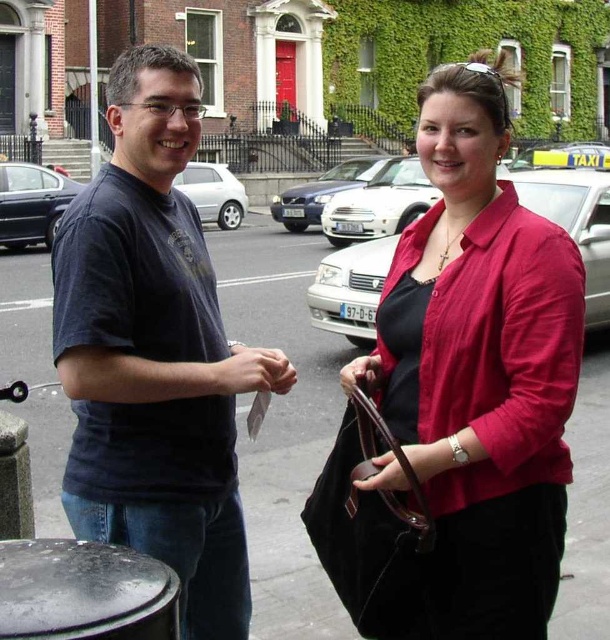
Question: Can you confirm if dark blue t-shirt at left is wider than leather handbag at lower center?

Choices:
 (A) yes
 (B) no

Answer: (B)

Question: Among these objects, which one is farthest from the camera?

Choices:
 (A) matte pink blouse at center
 (B) leather handbag at lower center

Answer: (B)

Question: Is black asphalt pavement at lower center to the left of matte paper money at center from the viewer's perspective?

Choices:
 (A) yes
 (B) no

Answer: (A)

Question: Is the position of dark blue t-shirt at left more distant than that of black asphalt pavement at lower center?

Choices:
 (A) yes
 (B) no

Answer: (B)

Question: Based on their relative distances, which object is nearer to the black asphalt pavement at lower center?

Choices:
 (A) dark blue t-shirt at left
 (B) leather at center

Answer: (B)

Question: Which is nearer to the leather at center?

Choices:
 (A) leather handbag at lower center
 (B) matte paper money at center
 (C) black asphalt pavement at lower center
 (D) dark blue t-shirt at left

Answer: (A)